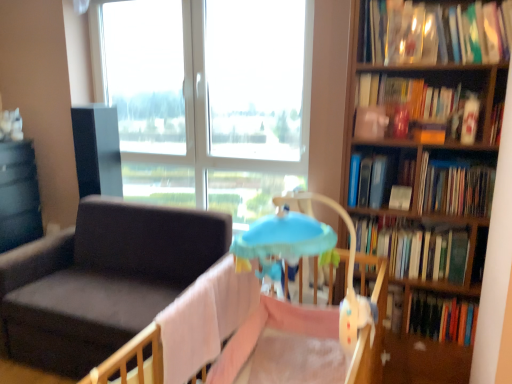
Question: From the image's perspective, is pink fabric infant bed at center positioned above or below matte black table at left?

Choices:
 (A) below
 (B) above

Answer: (A)

Question: Is pink fabric infant bed at center inside or outside of matte black table at left?

Choices:
 (A) outside
 (B) inside

Answer: (A)

Question: Considering the real-world distances, which object is closest to the matte black table at left?

Choices:
 (A) wooden bookshelf at right
 (B) dark gray fabric chair at left
 (C) hardcover book at right, positioned as the 2th book in bottom-to-top order
 (D) hardcover book at upper right, marked as the 4th book in a bottom-to-top arrangement
 (E) transparent glass window at upper center

Answer: (B)

Question: Which is farther from the hardcover book at upper right, which is counted as the third book, starting from the top?

Choices:
 (A) dark gray fabric chair at left
 (B) pink fabric infant bed at center
 (C) hardcover book at right, which ranks as the 4th book in top-to-bottom order
 (D) transparent glass window at upper center
 (E) hardcover book at upper right, the second book from the top

Answer: (A)